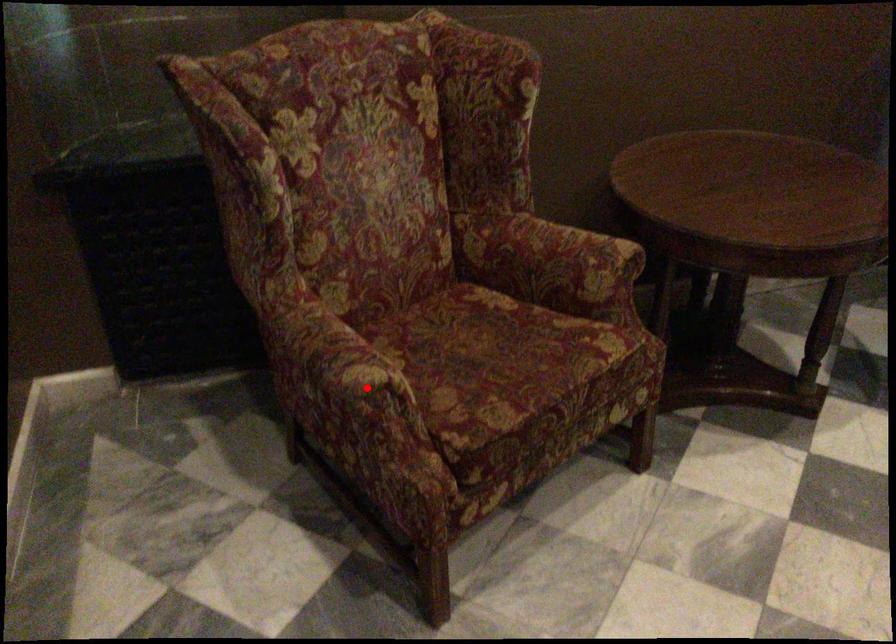
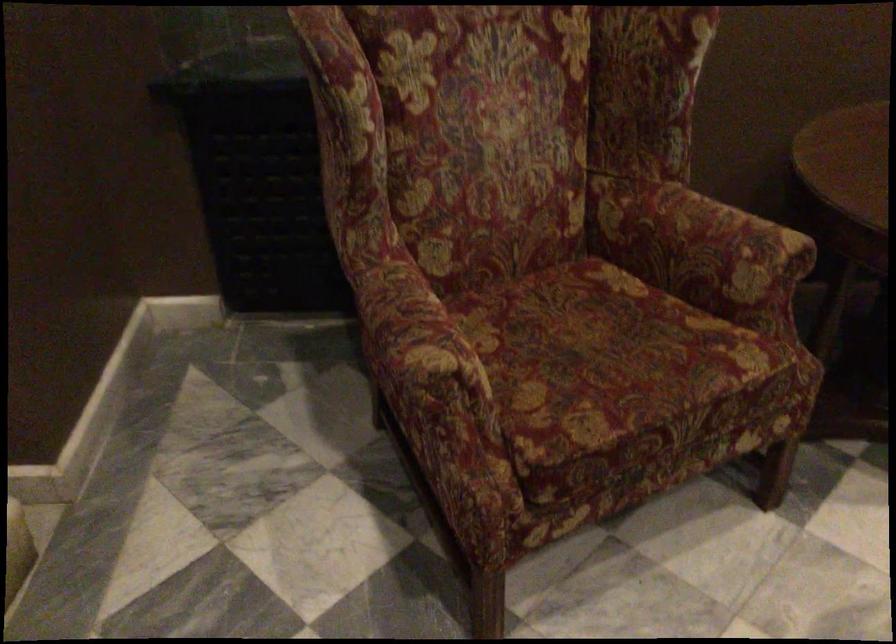
Question: I am providing you with two images of the same scene from different viewpoints. Image1 has a red point marked. In image2, the corresponding 3D location appears at what relative position? Reply with the corresponding letter.

Choices:
 (A) Closer
 (B) Farther

Answer: (A)